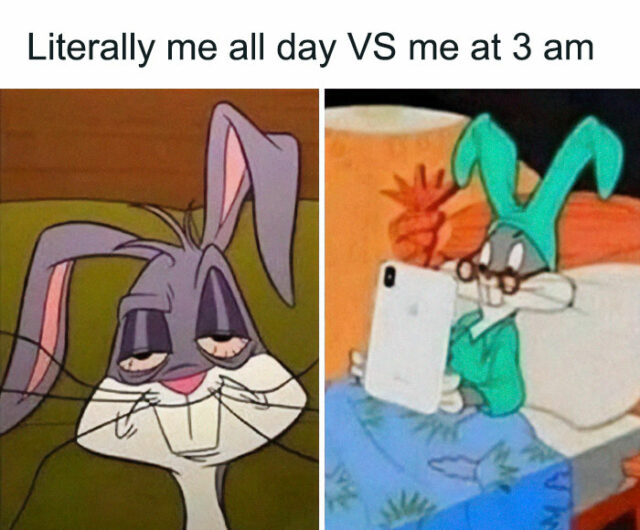
This screenshot has height=530, width=640. What are the coordinates of `pillow` in the screenshot? It's located at (603, 355).